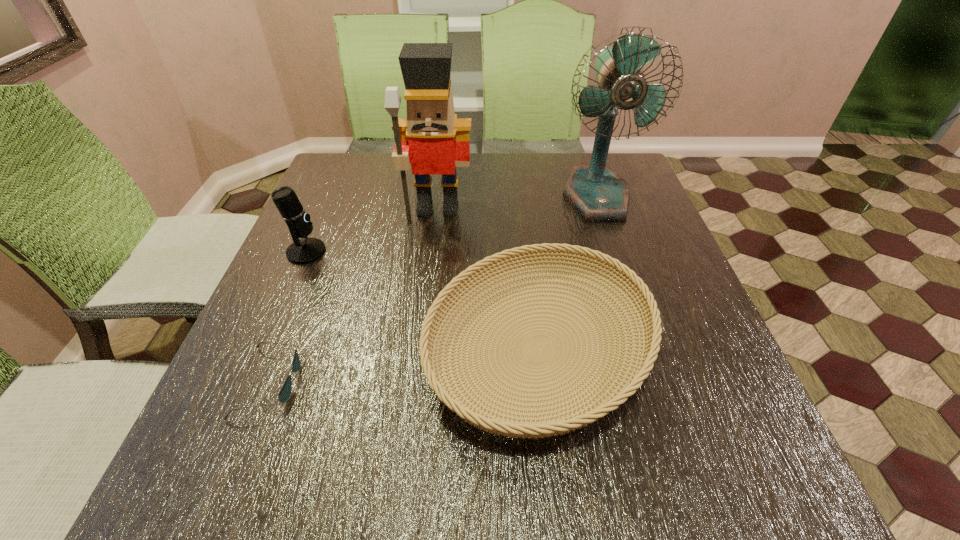
At what (x,y) coordinates should I click in order to perform the action: click on fan. Please return your answer as a coordinate pair (x, y). This screenshot has width=960, height=540. Looking at the image, I should click on (598, 194).

Locate an element on the screen. This screenshot has width=960, height=540. nutcracker is located at coordinates coord(432,139).

The image size is (960, 540). What are the coordinates of `the third shortest object` in the screenshot? It's located at (306, 250).

This screenshot has height=540, width=960. What are the coordinates of `the third farthest object` in the screenshot? It's located at click(x=306, y=250).

Find the location of `the fourth tallest object`. the fourth tallest object is located at coordinates (463, 403).

Locate an element on the screen. The width and height of the screenshot is (960, 540). the shortest object is located at coordinates (284, 394).

Where is `free space located in front of the fan where the wind blows`? free space located in front of the fan where the wind blows is located at coordinates (620, 265).

I want to click on vacant space situated in front of the nutcracker holding the staff, so click(428, 292).

You are a GUI agent. You are given a task and a screenshot of the screen. Output one action in this format:
    pyautogui.click(x=<x>, y=<y>)
    Task: Click on the vacant space located 0.090m on the right of the third shortest object
    
    Given the screenshot: What is the action you would take?
    pyautogui.click(x=364, y=252)

Identify the location of free space located on the left of the basket. (324, 350).